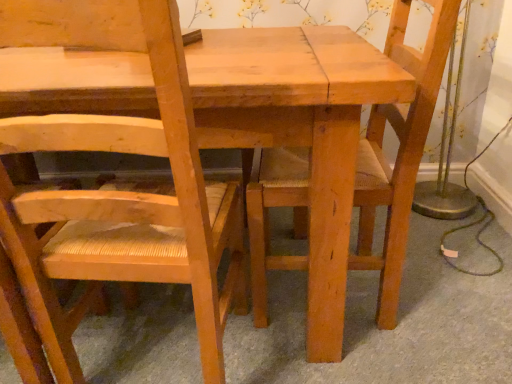
Identify the location of vacant space underneath natural wood chair at center, which ranks as the 1th chair in right-to-left order (from a real-world perspective). Image resolution: width=512 pixels, height=384 pixels. (303, 283).